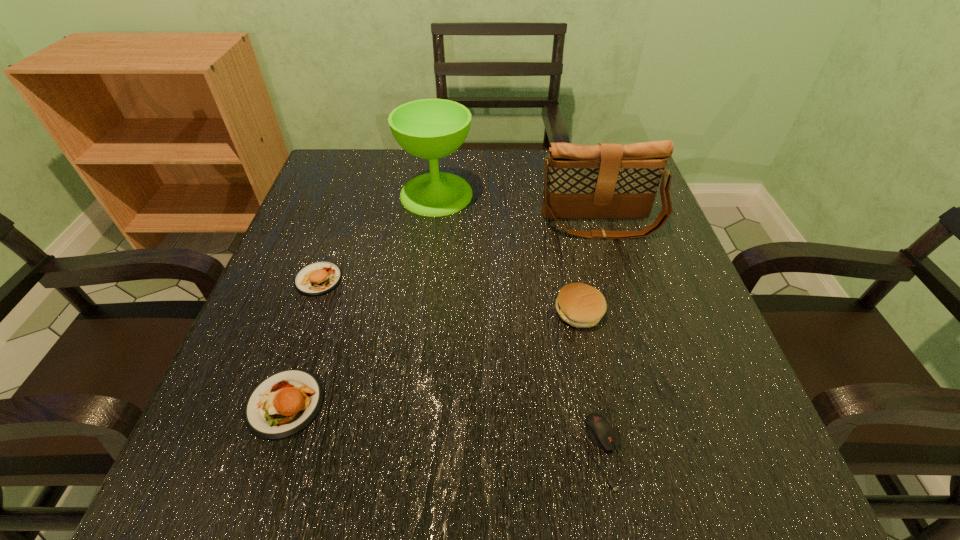
Identify the location of object that stands as the closest to the mouse. (580, 305).

Identify which object is located as the third nearest to the shoulder bag. Please provide its 2D coordinates. Your answer should be formatted as a tuple, i.e. [(x, y)], where the tuple contains the x and y coordinates of a point satisfying the conditions above.

[(601, 433)]

Choose which patty (food) is the nearest neighbor to the shoulder bag. Please provide its 2D coordinates. Your answer should be formatted as a tuple, i.e. [(x, y)], where the tuple contains the x and y coordinates of a point satisfying the conditions above.

[(580, 305)]

Identify which patty (food) is the closest to the rightmost patty (food). Please provide its 2D coordinates. Your answer should be formatted as a tuple, i.e. [(x, y)], where the tuple contains the x and y coordinates of a point satisfying the conditions above.

[(283, 404)]

The width and height of the screenshot is (960, 540). I want to click on vacant space that satisfies the following two spatial constraints: 1. on the back side of the fourth object from right to left; 2. on the left side of the fifth tallest object, so click(x=355, y=194).